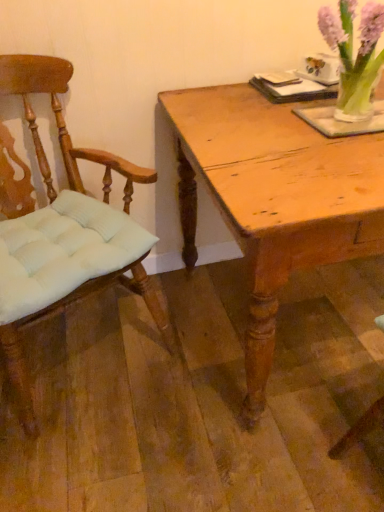
Question: Would you say light brown wooden table at center is inside or outside translucent glass vase at upper right?

Choices:
 (A) inside
 (B) outside

Answer: (B)

Question: In the image, is light brown wooden table at center positioned in front of or behind translucent glass vase at upper right?

Choices:
 (A) behind
 (B) front

Answer: (B)

Question: Considering the real-world distances, which object is closest to the light brown wood chair at left?

Choices:
 (A) light brown wooden table at center
 (B) translucent glass vase at upper right

Answer: (A)

Question: Which of these objects is positioned closest to the light brown wooden table at center?

Choices:
 (A) translucent glass vase at upper right
 (B) light brown wood chair at left

Answer: (A)